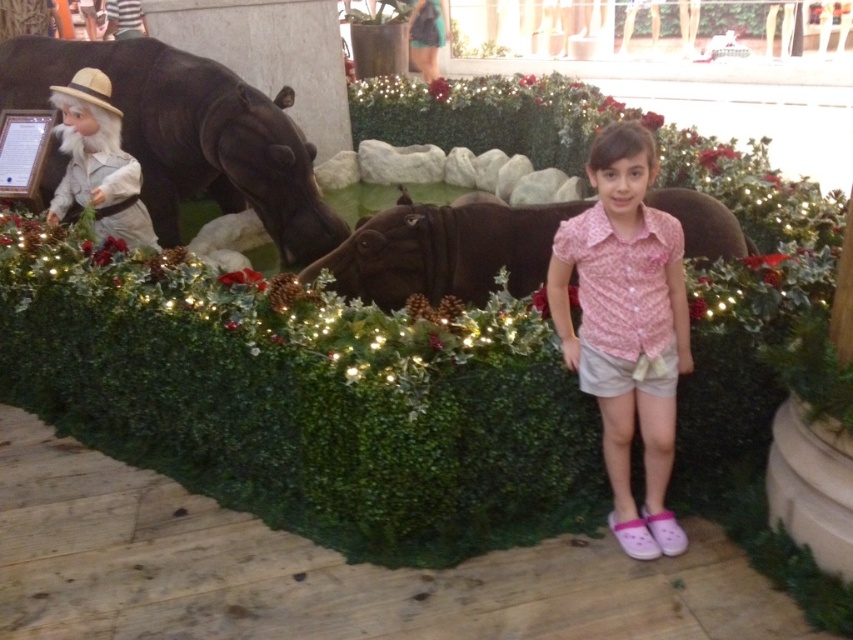
You are a photographer setting up a shot of the pink floral shirt at center and the brown matte hippo at center. Which object should you adjust to ensure both are in frame? Explain your reasoning.

The pink floral shirt at center is located below the brown matte hippo at center. To ensure both are in frame, you should adjust the camera angle or position to include the lower area where the shirt is positioned and the higher area where the hippo is placed.

You are a photographer trying to capture a photo of the pink floral shirt at center and the brown matte hippo at center. Since you want to ensure both are in focus, you need to know their relative sizes. Which object is wider?

The pink floral shirt at center is thinner than the brown matte hippo at center, so the brown matte hippo at center is wider.